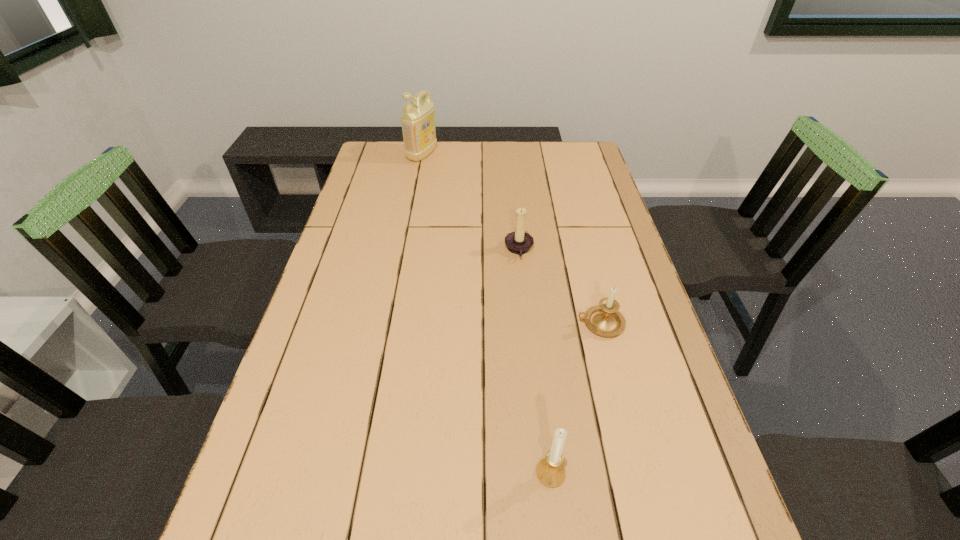
The width and height of the screenshot is (960, 540). I want to click on free spot at the right edge of the desktop, so 573,219.

The image size is (960, 540). In order to click on vacant space at the far right corner in this screenshot , I will do [x=587, y=143].

At what (x,y) coordinates should I click in order to perform the action: click on free space that is in between the detergent and the farthest candle holder. Please return your answer as a coordinate pair (x, y). The height and width of the screenshot is (540, 960). Looking at the image, I should click on (470, 202).

Where is `vacant space that is in between the nearest object and the second nearest candle holder`? Image resolution: width=960 pixels, height=540 pixels. vacant space that is in between the nearest object and the second nearest candle holder is located at coordinates (575, 398).

Identify the location of vacant space that's between the nearest candle holder and the third farthest object. (575, 398).

The width and height of the screenshot is (960, 540). In order to click on vacant space that is in between the nearest candle holder and the second farthest object in this screenshot , I will do `click(535, 361)`.

Where is `empty location between the leftmost object and the farthest candle holder`? The image size is (960, 540). empty location between the leftmost object and the farthest candle holder is located at coordinates (470, 202).

Identify the location of unoccupied position between the nearest object and the detergent. (487, 314).

Find the location of a particular element. free point between the leftmost object and the third nearest object is located at coordinates (470, 202).

Locate an element on the screen. empty space between the second nearest candle holder and the farthest candle holder is located at coordinates (560, 287).